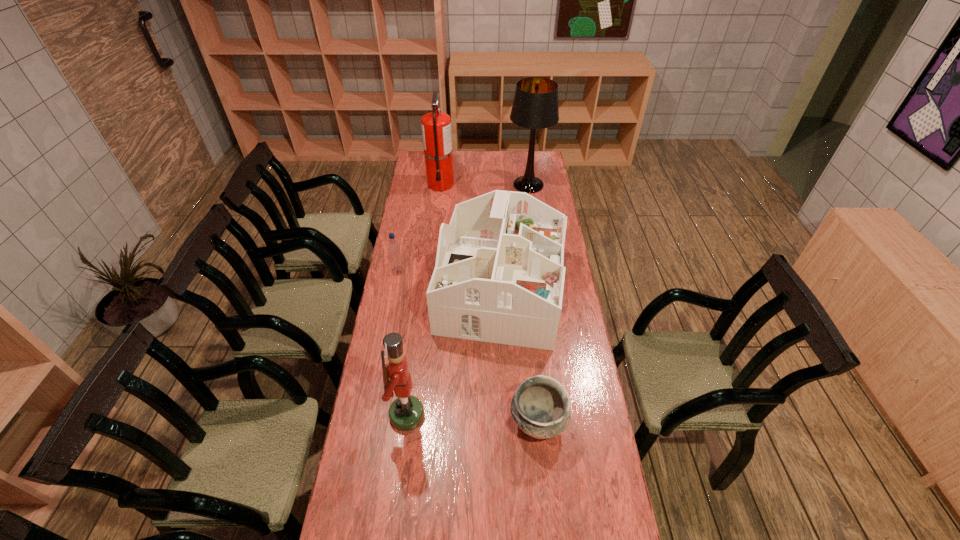
Locate an element on the screen. This screenshot has height=540, width=960. blank space located on the front of the dollhouse is located at coordinates (504, 374).

Where is `vacant region located on the right of the water bottle`? Image resolution: width=960 pixels, height=540 pixels. vacant region located on the right of the water bottle is located at coordinates (475, 271).

I want to click on vacant space located 0.070m on the right of the shortest object, so click(588, 422).

You are a GUI agent. You are given a task and a screenshot of the screen. Output one action in this format:
    pyautogui.click(x=<x>, y=<y>)
    Task: Click on the fire extinguisher at the left edge
    The height and width of the screenshot is (540, 960).
    Given the screenshot: What is the action you would take?
    pyautogui.click(x=436, y=126)

Where is `nutcracker located at the left edge`? This screenshot has height=540, width=960. nutcracker located at the left edge is located at coordinates (406, 413).

Where is `water bottle that is at the left edge`? This screenshot has height=540, width=960. water bottle that is at the left edge is located at coordinates (393, 248).

Where is `table lamp that is at the right edge`? table lamp that is at the right edge is located at coordinates [535, 106].

Locate an element on the screen. dollhouse present at the right edge is located at coordinates (499, 276).

This screenshot has width=960, height=540. I want to click on pottery present at the right edge, so click(x=540, y=407).

This screenshot has height=540, width=960. In the image, there is a desktop. Find the location of `vacant space at the far edge`. vacant space at the far edge is located at coordinates (492, 157).